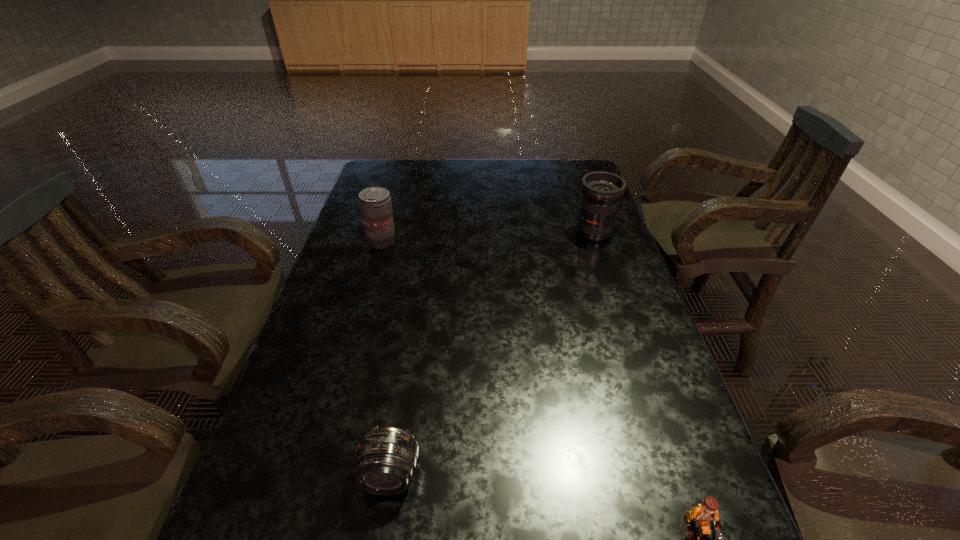
Point out which object is positioned as the third nearest to the leftmost object. Please provide its 2D coordinates. Your answer should be formatted as a tuple, i.e. [(x, y)], where the tuple contains the x and y coordinates of a point satisfying the conditions above.

[(699, 518)]

Identify which object is located as the second nearest to the second object from left to right. Please provide its 2D coordinates. Your answer should be formatted as a tuple, i.e. [(x, y)], where the tuple contains the x and y coordinates of a point satisfying the conditions above.

[(375, 203)]

Locate an element on the screen. This screenshot has height=540, width=960. telephoto lens that stands as the third closest to the Lego is located at coordinates (375, 203).

Identify the location of telephoto lens object that ranks as the second closest to the third tallest object. (601, 190).

Identify the location of vacant space that satisfies the following two spatial constraints: 1. on the front side of the rightmost telephoto lens; 2. on the side of the leftmost object where the control switches are located. pos(597,242).